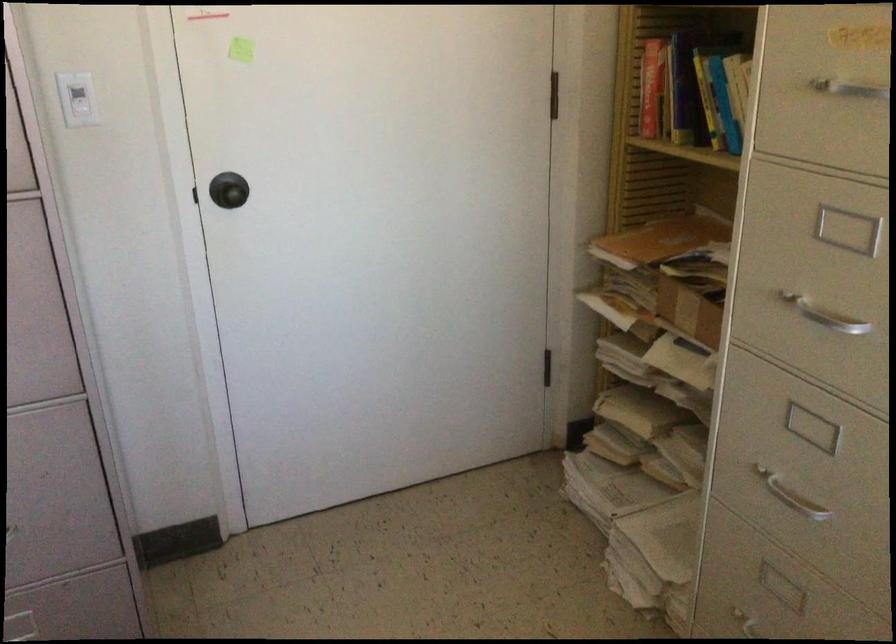
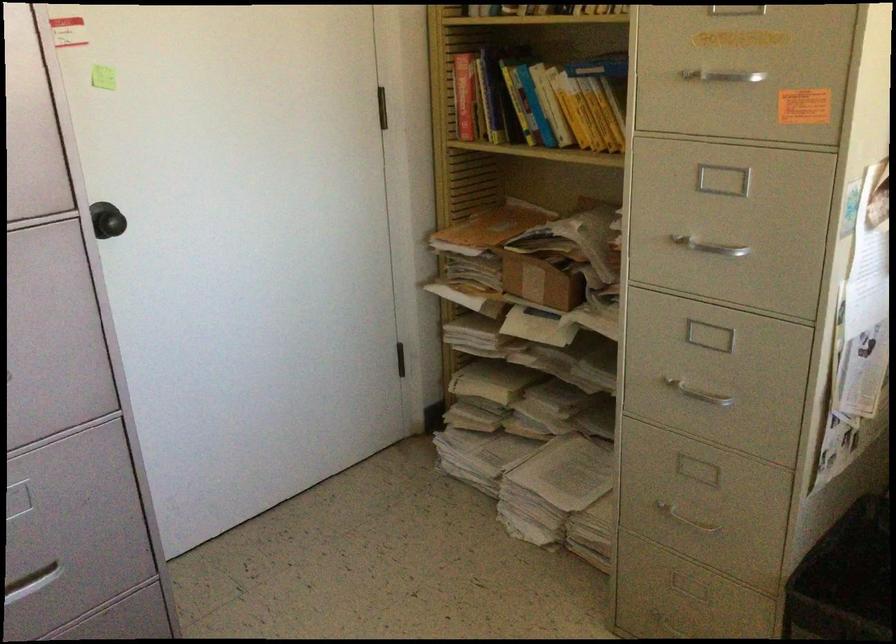
The point at (x=790, y=498) is marked in the first image. Where is the corresponding point in the second image?

(699, 391)